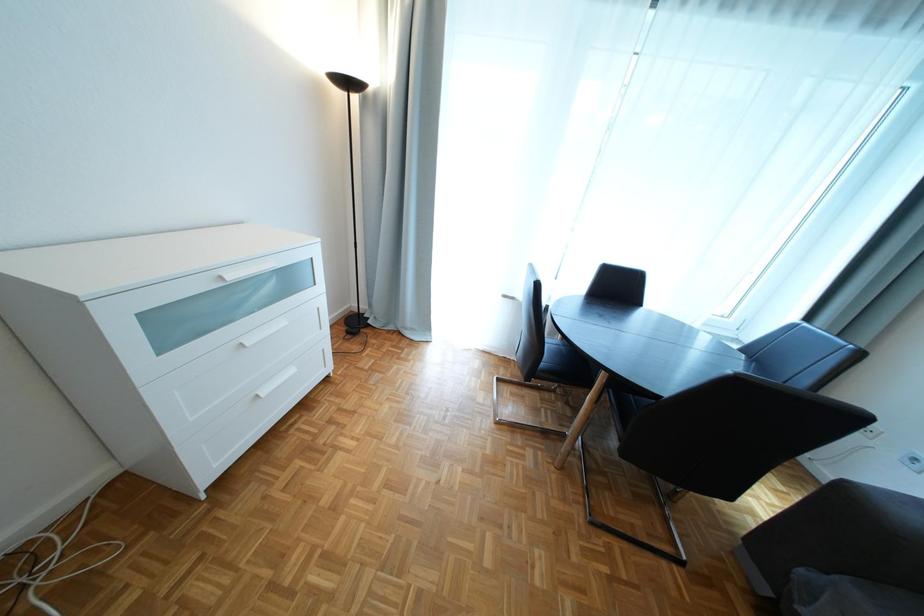
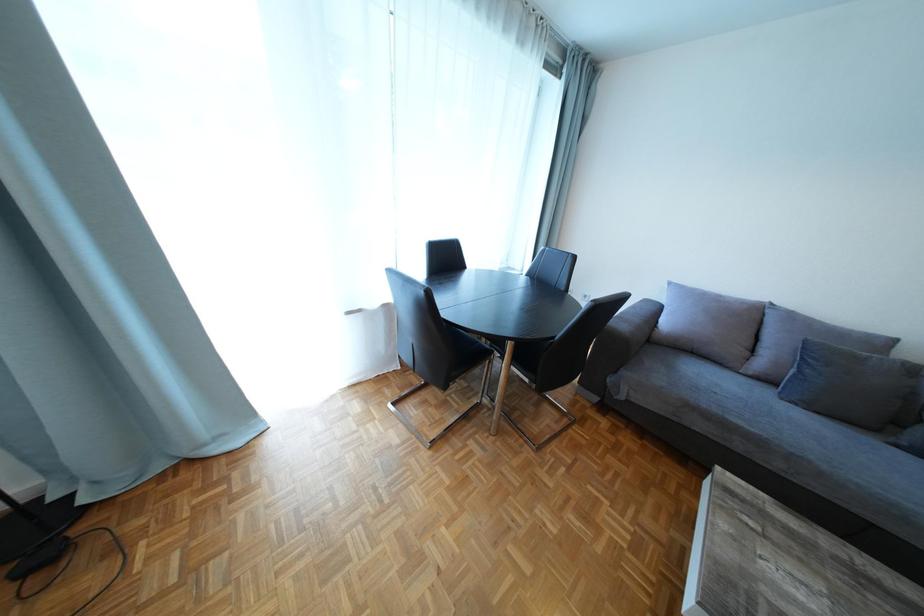
The images are taken continuously from a first-person perspective. In which direction is your viewpoint rotating?

The camera rotated toward right-down.